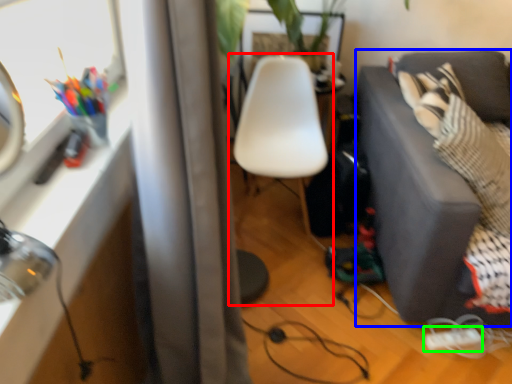
Question: Based on their relative distances, which object is farther from chair (highlighted by a red box)? Choose from studio couch (highlighted by a blue box) and extension cord (highlighted by a green box).

Choices:
 (A) studio couch
 (B) extension cord

Answer: (B)